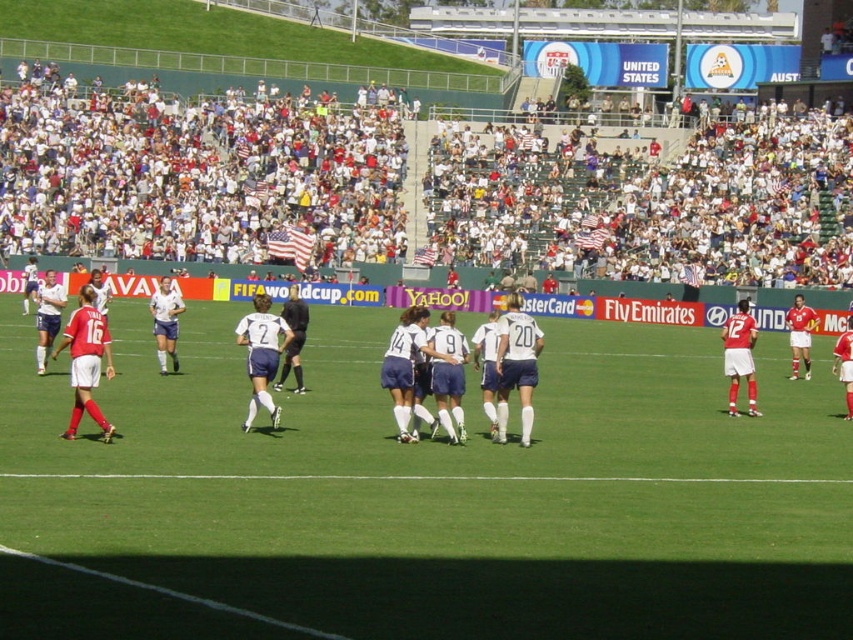
Can you confirm if white fabric crowd at upper center is shorter than blue fabric soccer players at center?

No.

Where is `white fabric crowd at upper center`? The height and width of the screenshot is (640, 853). white fabric crowd at upper center is located at coordinates (195, 172).

At what (x,y) coordinates should I click in order to perform the action: click on white fabric crowd at upper center. Please return your answer as a coordinate pair (x, y). The image size is (853, 640). Looking at the image, I should click on (195, 172).

Who is positioned more to the right, white fabric crowd at upper center or white jersey at center?

white fabric crowd at upper center is more to the right.

Consider the image. Does white fabric crowd at upper center have a greater height compared to white jersey at center?

Yes.

Between point (252, 196) and point (286, 353), which one is positioned in front?

Positioned in front is point (286, 353).

Find the location of a particular element. white fabric crowd at upper center is located at coordinates (195, 172).

Can you confirm if green grass football field at center is taller than white fabric crowd at upper center?

No.

Who is positioned more to the left, green grass football field at center or white fabric crowd at upper center?

white fabric crowd at upper center

Which is in front, point (109, 588) or point (42, 244)?

Positioned in front is point (109, 588).

Locate an element on the screen. green grass football field at center is located at coordinates (427, 497).